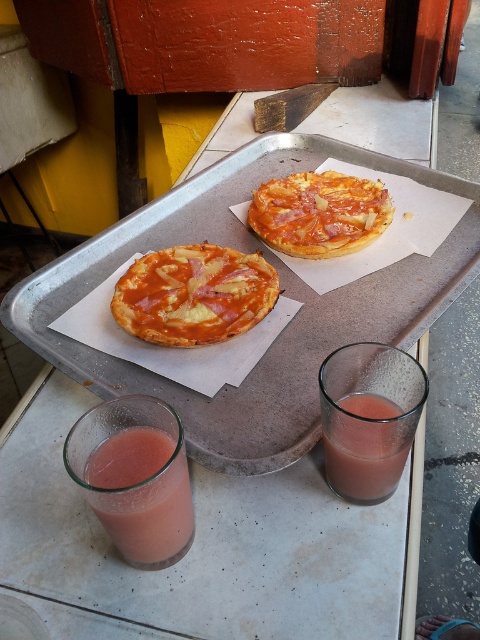
The image size is (480, 640). Describe the element at coordinates (143, 493) in the screenshot. I see `translucent glass at lower left` at that location.

Who is more distant from viewer, (x=133, y=464) or (x=278, y=214)?

Positioned behind is point (x=278, y=214).

What do you see at coordinates (143, 493) in the screenshot? The width and height of the screenshot is (480, 640). I see `translucent glass at lower left` at bounding box center [143, 493].

Locate an element on the screen. The width and height of the screenshot is (480, 640). translucent glass at lower left is located at coordinates (143, 493).

Does matte orange pizza at left have a lesser width compared to translucent glass at lower left?

Incorrect, matte orange pizza at left's width is not less than translucent glass at lower left's.

Does point (156, 300) come in front of point (98, 509)?

No.

This screenshot has height=640, width=480. Find the location of `matte orange pizza at left`. matte orange pizza at left is located at coordinates (193, 294).

Between point (33, 394) and point (288, 241), which one is positioned in front?

Point (33, 394) is more forward.

Does transparent glass at center appear on the right side of golden-brown crispy pizza at center?

No, transparent glass at center is not to the right of golden-brown crispy pizza at center.

The image size is (480, 640). What are the coordinates of `transparent glass at center` in the screenshot? It's located at (204, 547).